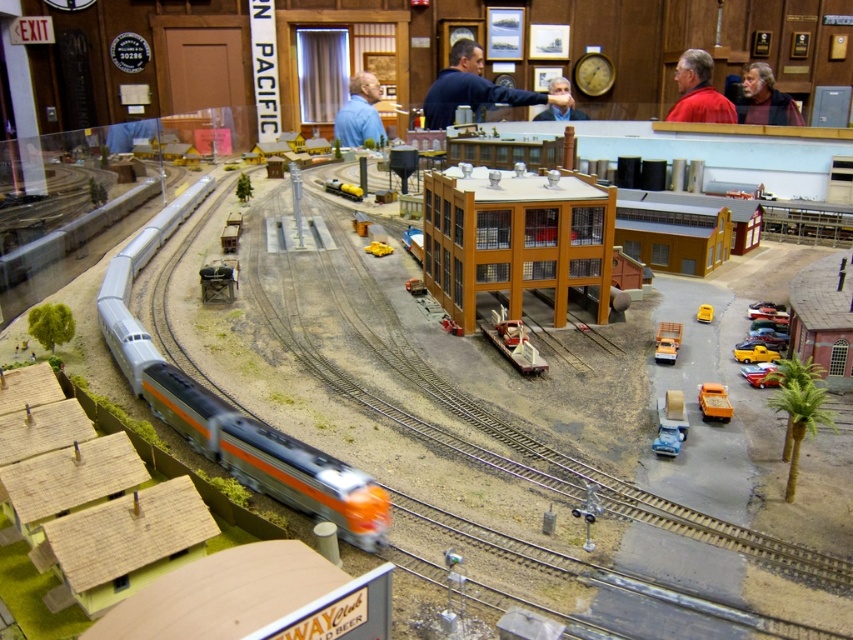
You are a visitor at the model train exhibition and notice two shirts displayed near the layout. The red matte shirt at upper right and the blue fabric shirt at center. Which shirt is taller?

The red matte shirt at upper right is taller than the blue fabric shirt at center.

You are a visitor at the model train exhibition and want to take a photo of the silver metallic train at lower left and the matte black face mask at center. Which object should you focus on first to ensure both are in sharp focus?

You should focus on the silver metallic train at lower left first because it is closer to you than the matte black face mask at center, so adjusting focus from near to far will help both be in sharp focus.